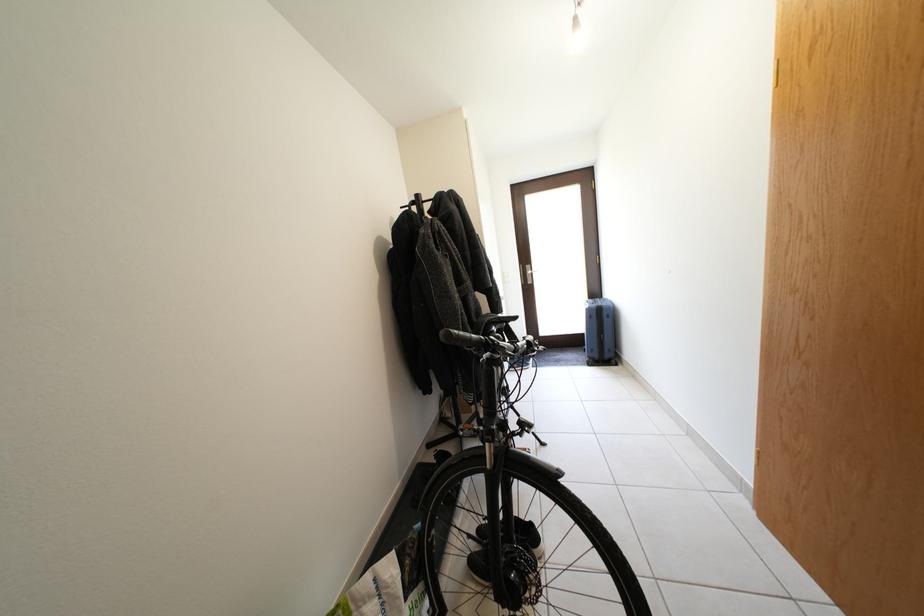
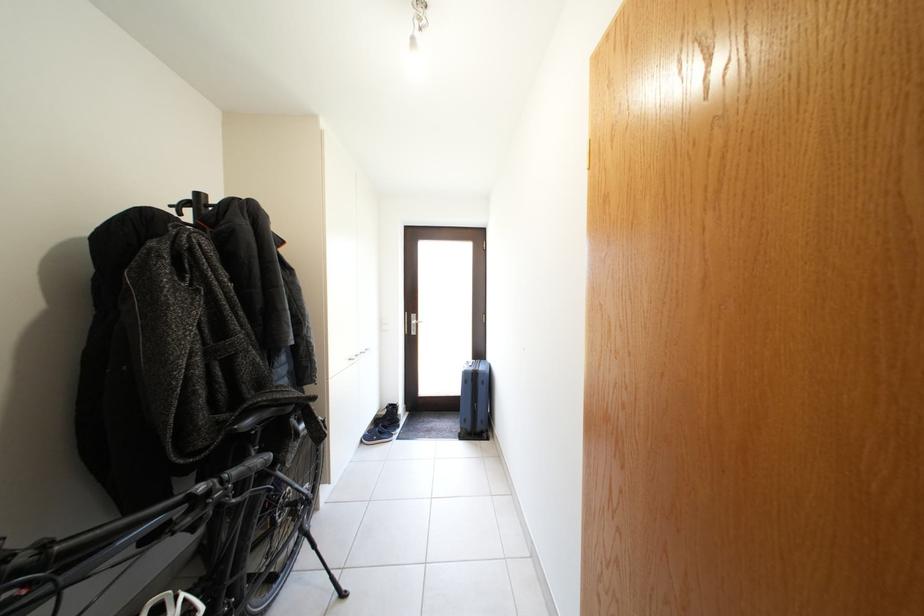
The point at [427,201] is marked in the first image. Where is the corresponding point in the second image?

(205, 200)